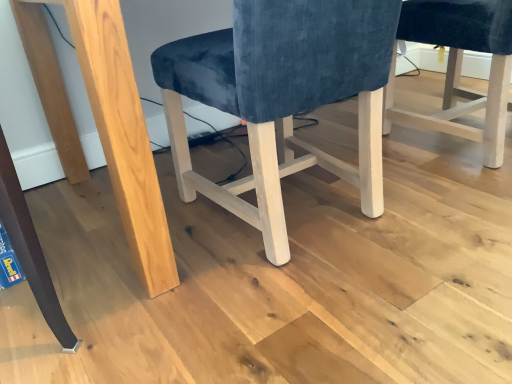
Question: Considering the positions of point (272, 18) and point (494, 13), is point (272, 18) closer or farther from the camera than point (494, 13)?

Choices:
 (A) farther
 (B) closer

Answer: (B)

Question: Which is correct: velvet blue chair at center, acting as the second chair starting from the right, is inside velvet blue chair at center, which is the first chair in right-to-left order, or outside of it?

Choices:
 (A) inside
 (B) outside

Answer: (B)

Question: Considering the relative positions of velvet blue chair at center, which is the 1th chair from left to right, and velvet blue chair at center, which is the first chair in right-to-left order, in the image provided, is velvet blue chair at center, which is the 1th chair from left to right, to the left or to the right of velvet blue chair at center, which is the first chair in right-to-left order,?

Choices:
 (A) right
 (B) left

Answer: (B)

Question: Is velvet blue chair at center, which is the first chair in right-to-left order, to the left or to the right of velvet blue chair at center, acting as the second chair starting from the right, in the image?

Choices:
 (A) right
 (B) left

Answer: (A)

Question: Is point 505,77 closer or farther from the camera than point 163,44?

Choices:
 (A) closer
 (B) farther

Answer: (A)

Question: Considering the positions of velvet blue chair at center, which is the first chair in right-to-left order, and velvet blue chair at center, acting as the second chair starting from the right, in the image, is velvet blue chair at center, which is the first chair in right-to-left order, taller or shorter than velvet blue chair at center, acting as the second chair starting from the right,?

Choices:
 (A) short
 (B) tall

Answer: (A)

Question: Is velvet blue chair at center, the 2th chair viewed from the left, bigger or smaller than velvet blue chair at center, acting as the second chair starting from the right?

Choices:
 (A) big
 (B) small

Answer: (B)